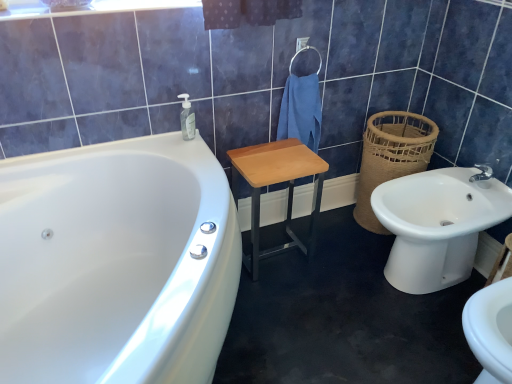
Where is `empty space that is ontop of wooden/matte step stool at center`? The width and height of the screenshot is (512, 384). empty space that is ontop of wooden/matte step stool at center is located at coordinates 280,157.